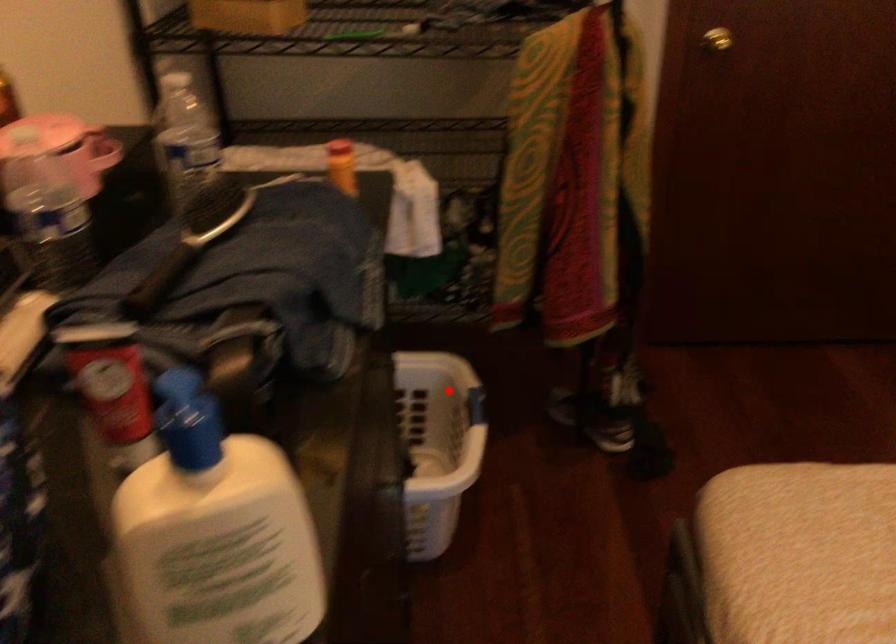
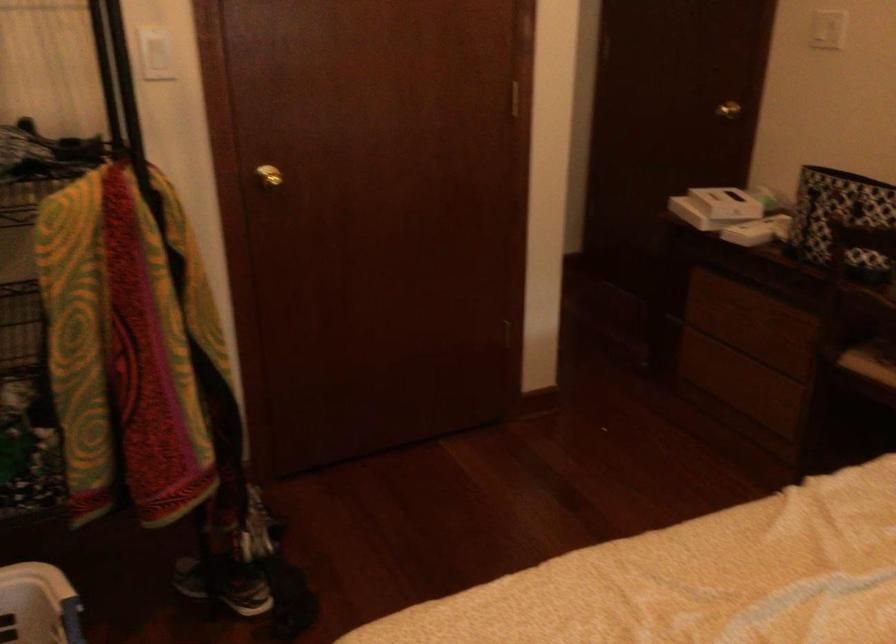
Question: I am providing you with two images of the same scene from different viewpoints. A red point is shown in image1. For the corresponding object point in image2, is it positioned nearer or farther from the camera?

Choices:
 (A) Nearer
 (B) Farther

Answer: (A)